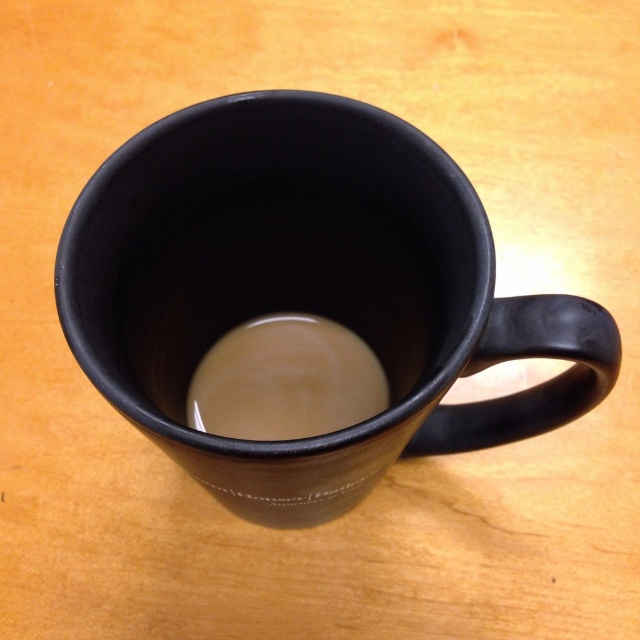
Does matte black mug at center lie in front of creamy matte coffee at center?

That is True.

Is matte black mug at center bigger than creamy matte coffee at center?

Indeed, matte black mug at center has a larger size compared to creamy matte coffee at center.

Is point (164, 196) closer to camera compared to point (336, 340)?

Yes.

Find the location of a particular element. This screenshot has width=640, height=640. matte black mug at center is located at coordinates (308, 291).